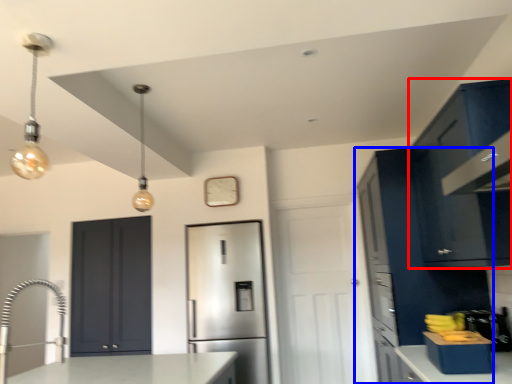
Question: Among these objects, which one is nearest to the camera, cabinetry (highlighted by a red box) or cabinetry (highlighted by a blue box)?

Choices:
 (A) cabinetry
 (B) cabinetry

Answer: (A)